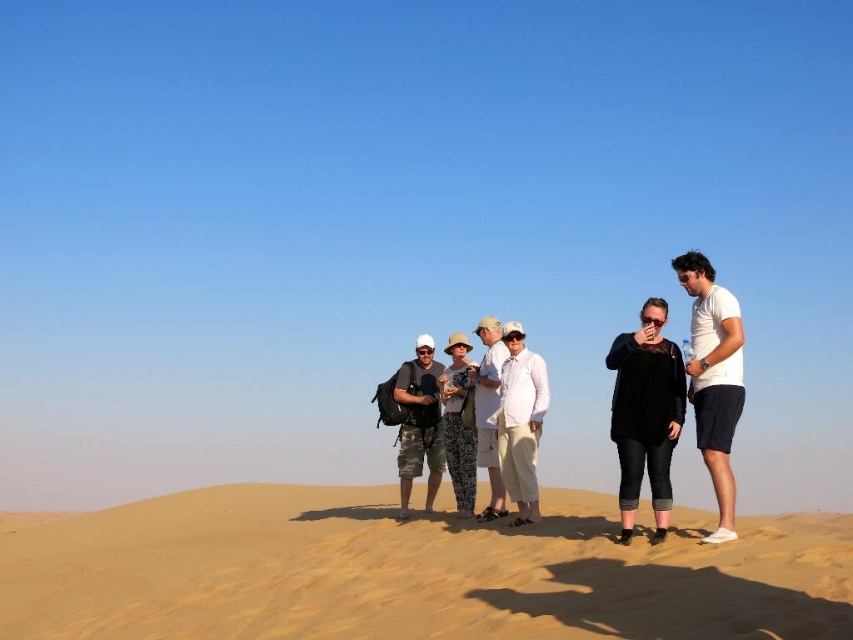
From the picture: Who is lower down, fine-grained sand at center or camo fabric shorts at center?

fine-grained sand at center is lower down.

Image resolution: width=853 pixels, height=640 pixels. What do you see at coordinates (410, 572) in the screenshot?
I see `fine-grained sand at center` at bounding box center [410, 572].

In order to click on fine-grained sand at center in this screenshot , I will do `click(410, 572)`.

Who is lower down, camo fabric shorts at center or white textured shirt at center?

camo fabric shorts at center is below.

Who is higher up, camo fabric shorts at center or white textured shirt at center?

white textured shirt at center is above.

Is point (401, 401) less distant than point (492, 355)?

No, (401, 401) is further to viewer.

You are a GUI agent. You are given a task and a screenshot of the screen. Output one action in this format:
    pyautogui.click(x=<x>, y=<y>)
    Task: Click on the camo fabric shorts at center
    Image resolution: width=853 pixels, height=640 pixels.
    Given the screenshot: What is the action you would take?
    click(x=419, y=461)

Which is behind, point (152, 538) or point (491, 362)?

Point (152, 538)

Can you confirm if fine-grained sand at center is wider than white textured shirt at center?

Correct, the width of fine-grained sand at center exceeds that of white textured shirt at center.

Between point (575, 522) and point (495, 426), which one is positioned behind?

The point (495, 426) is behind.

Where is `fine-grained sand at center`? fine-grained sand at center is located at coordinates (410, 572).